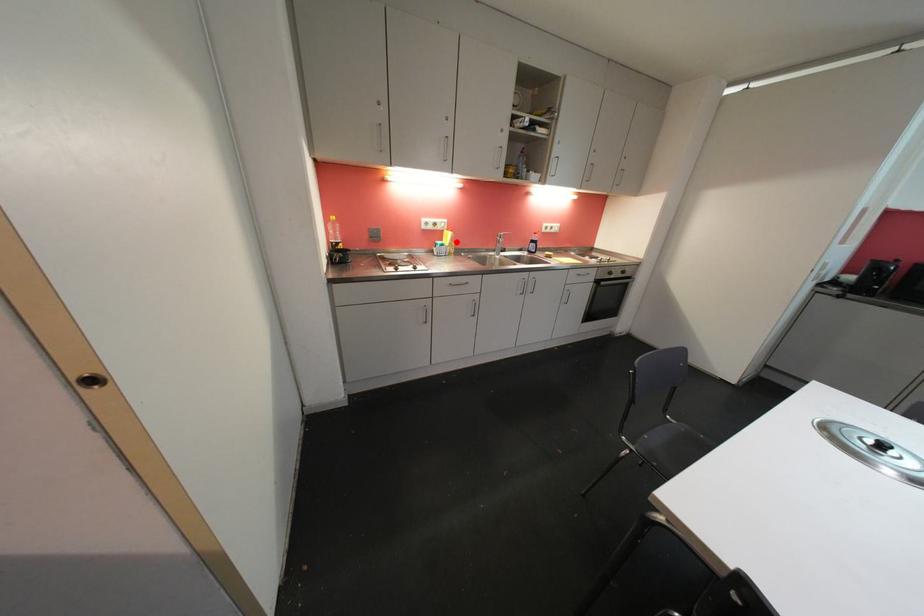
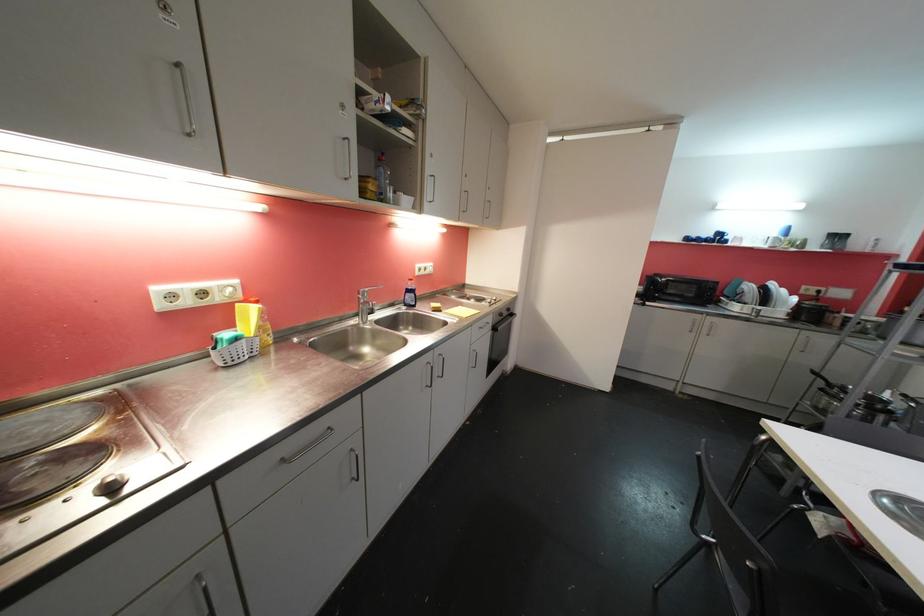
Find the pixel in the second image that matches the highlighted location in the first image.

(265, 322)